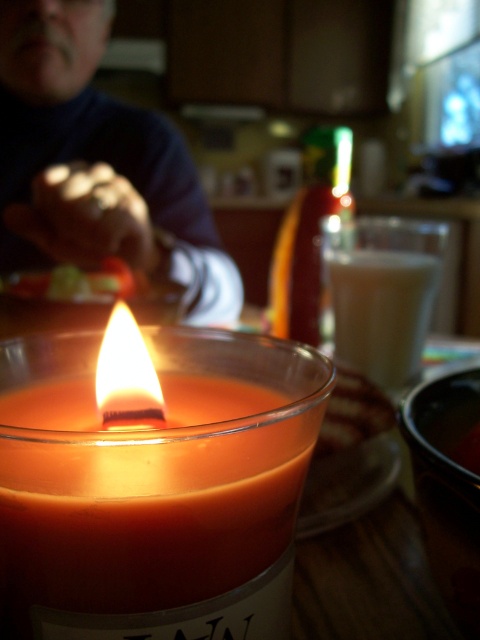
In the scene shown: Between smokey orange wax candle at center and translucent glass candle at center, which one is positioned lower?

Positioned lower is smokey orange wax candle at center.

Does smokey orange wax candle at center have a lesser width compared to translucent glass candle at center?

No, smokey orange wax candle at center is not thinner than translucent glass candle at center.

Does point (227, 451) come behind point (373, 360)?

No.

The height and width of the screenshot is (640, 480). Find the location of `smokey orange wax candle at center`. smokey orange wax candle at center is located at coordinates (155, 486).

Does point (143, 564) come farther from viewer compared to point (118, 218)?

No, (143, 564) is closer to viewer.

Can you confirm if smokey orange wax candle at center is smaller than blue sweater at upper left?

Indeed, smokey orange wax candle at center has a smaller size compared to blue sweater at upper left.

Where is `smokey orange wax candle at center`? The width and height of the screenshot is (480, 640). smokey orange wax candle at center is located at coordinates (155, 486).

Where is `smokey orange wax candle at center`? This screenshot has height=640, width=480. smokey orange wax candle at center is located at coordinates (155, 486).

Is point (118, 148) farther from viewer compared to point (434, 280)?

Yes, point (118, 148) is farther from viewer.

Who is more forward, (84, 134) or (373, 364)?

Point (373, 364) is in front.

Find the location of a particular element. The width and height of the screenshot is (480, 640). blue sweater at upper left is located at coordinates (97, 164).